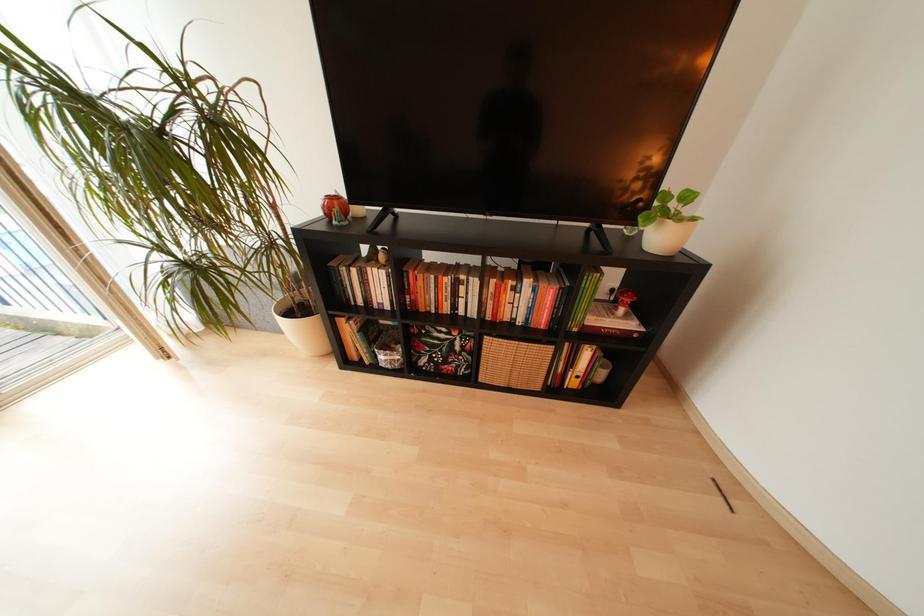
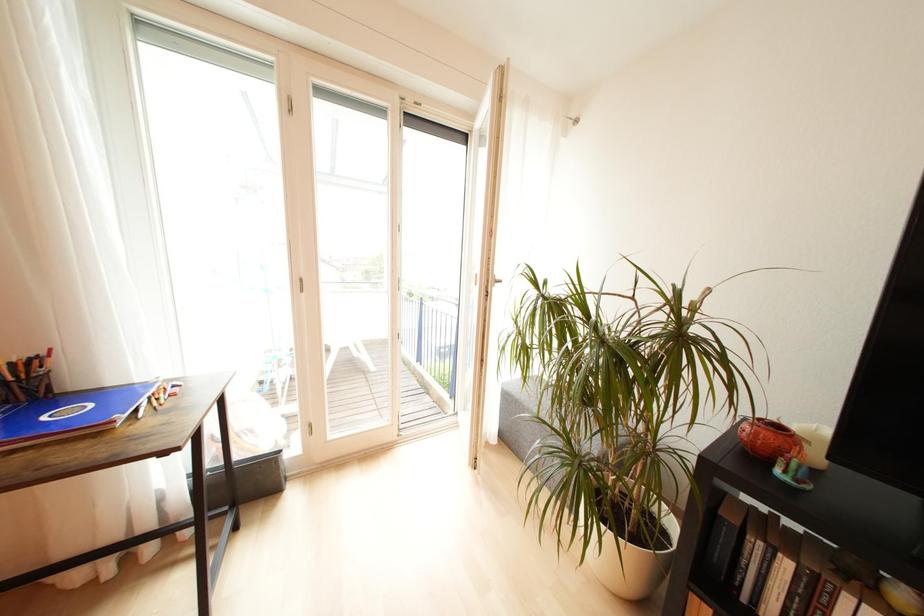
Question: The camera is either moving clockwise (left) or counter-clockwise (right) around the object. The first image is from the beginning of the video and the second image is from the end. Is the camera moving left or right when shooting the video?

Choices:
 (A) Left
 (B) Right

Answer: (B)